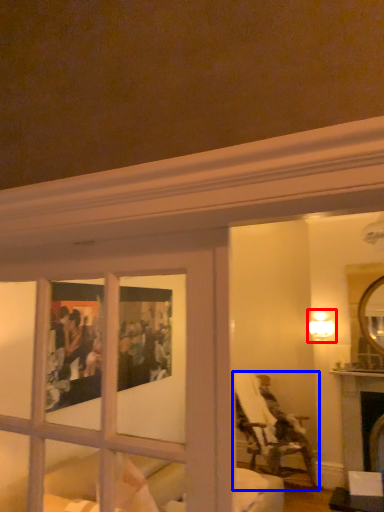
Question: Which point is further to the camera, light fixture (highlighted by a red box) or chair (highlighted by a blue box)?

Choices:
 (A) light fixture
 (B) chair

Answer: (A)